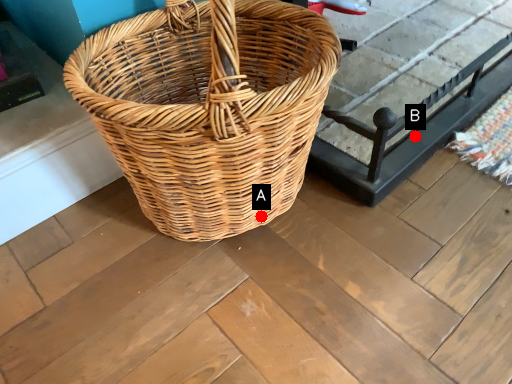
Question: Two points are circled on the image, labeled by A and B beside each circle. Which of the following is the closest to the observer?

Choices:
 (A) A is closer
 (B) B is closer

Answer: (A)